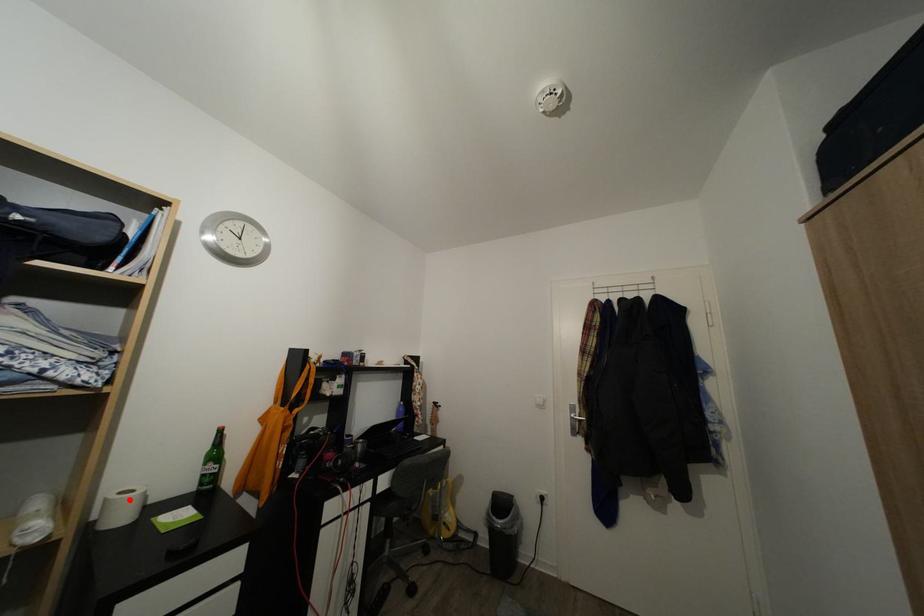
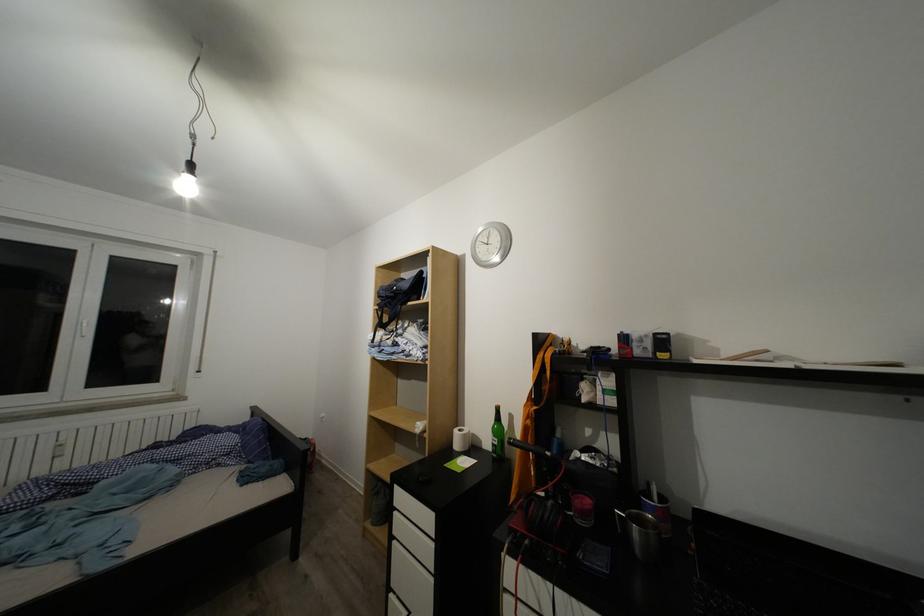
Locate, in the second image, the point that corresponds to the highlighted location in the first image.

(468, 436)